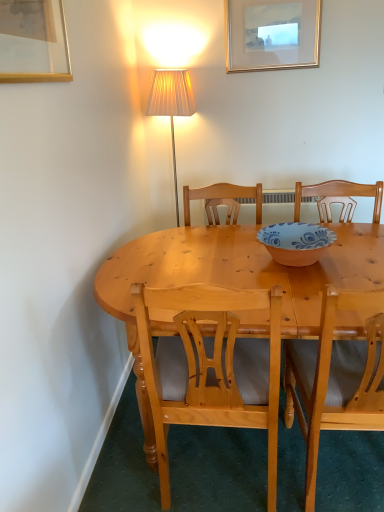
You are a GUI agent. You are given a task and a screenshot of the screen. Output one action in this format:
    pyautogui.click(x=<x>, y=<y>)
    Task: Click on the vacant space underneath light wood chair at center, acting as the first chair starting from the left (from a real-world perspective)
    Image resolution: width=384 pixels, height=512 pixels.
    Given the screenshot: What is the action you would take?
    pyautogui.click(x=230, y=470)